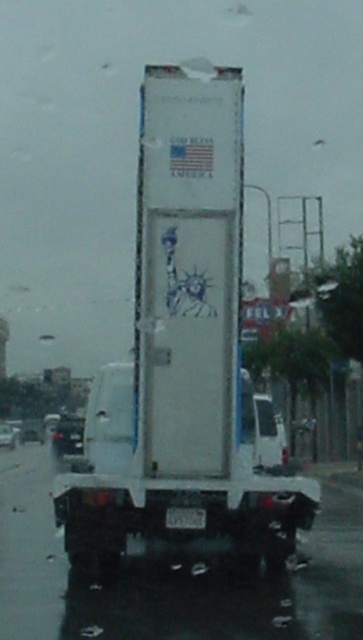
Question: Estimate the real-world distances between objects in this image. Which object is farther from the transparent glass windshield at center?

Choices:
 (A) black plastic license plate at center
 (B) shiny black car at lower left

Answer: (B)

Question: Is transparent glass windshield at center smaller than black plastic license plate at center?

Choices:
 (A) no
 (B) yes

Answer: (A)

Question: Which object is positioned farthest from the black plastic license plate at center?

Choices:
 (A) white matte truck at center
 (B) metallic silver car at center
 (C) white matte trailer truck at center

Answer: (B)

Question: Does transparent glass windshield at center have a lesser width compared to white matte truck at center?

Choices:
 (A) no
 (B) yes

Answer: (B)

Question: Which point is farther from the camera taking this photo?

Choices:
 (A) (117, 426)
 (B) (262, 396)
 (C) (10, 440)
 (D) (168, 516)

Answer: (C)

Question: Is black plastic license plate at center wider than metallic silver car at center?

Choices:
 (A) no
 (B) yes

Answer: (A)